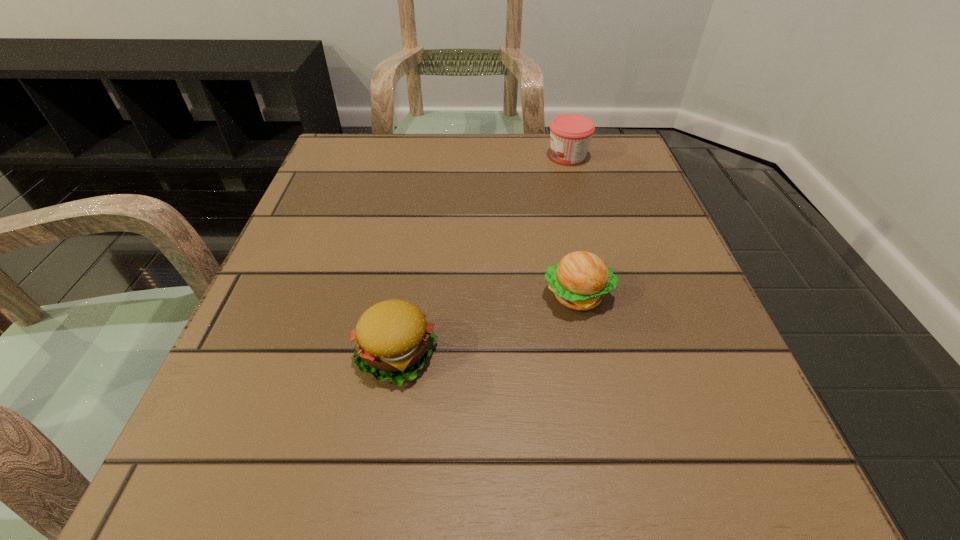
At what (x,y) coordinates should I click in order to perform the action: click on unoccupied area between the right hamburger and the leftmost object. Please return your answer as a coordinate pair (x, y). The height and width of the screenshot is (540, 960). Looking at the image, I should click on (488, 325).

This screenshot has height=540, width=960. What are the coordinates of `empty location between the jam and the second farthest object` in the screenshot? It's located at tap(572, 226).

The width and height of the screenshot is (960, 540). Find the location of `vacant area that lies between the nearest object and the right hamburger`. vacant area that lies between the nearest object and the right hamburger is located at coordinates click(x=488, y=325).

Locate an element on the screen. Image resolution: width=960 pixels, height=540 pixels. free space between the jam and the right hamburger is located at coordinates (572, 226).

Find the location of `empty space that is in between the jam and the left hamburger`. empty space that is in between the jam and the left hamburger is located at coordinates (483, 255).

Find the location of a particular element. This screenshot has width=960, height=540. empty location between the leftmost object and the farthest object is located at coordinates (483, 255).

Locate an element on the screen. free space between the second farthest object and the leftmost object is located at coordinates (488, 325).

Identify the location of empty location between the farther hamburger and the left hamburger. (488, 325).

The width and height of the screenshot is (960, 540). Find the location of `vacant space that's between the leftmost object and the second nearest object`. vacant space that's between the leftmost object and the second nearest object is located at coordinates (488, 325).

Where is `free area in between the second farthest object and the left hamburger`? free area in between the second farthest object and the left hamburger is located at coordinates (488, 325).